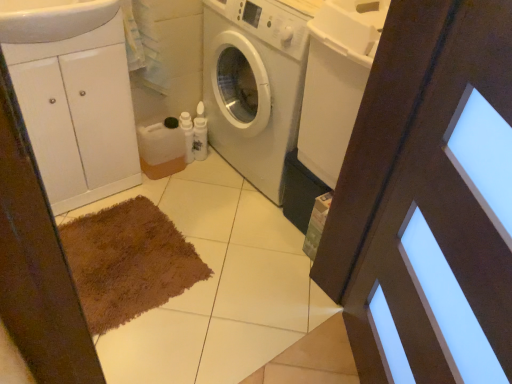
Question: Could you tell me if white glossy cabinet at left is facing white glossy sink at upper left?

Choices:
 (A) yes
 (B) no

Answer: (B)

Question: From the image's perspective, is white glossy cabinet at left beneath white glossy sink at upper left?

Choices:
 (A) no
 (B) yes

Answer: (B)

Question: Is white glossy cabinet at left bigger than white glossy sink at upper left?

Choices:
 (A) yes
 (B) no

Answer: (A)

Question: Is white glossy cabinet at left looking in the opposite direction of white glossy sink at upper left?

Choices:
 (A) yes
 (B) no

Answer: (B)

Question: Is white glossy cabinet at left behind white glossy sink at upper left?

Choices:
 (A) yes
 (B) no

Answer: (A)

Question: From a real-world perspective, is brown wooden screen door at center positioned above or below white glossy cabinet at left?

Choices:
 (A) below
 (B) above

Answer: (B)

Question: Looking at their shapes, would you say brown wooden screen door at center is wider or thinner than white glossy cabinet at left?

Choices:
 (A) wide
 (B) thin

Answer: (B)

Question: Is brown wooden screen door at center inside or outside of white glossy cabinet at left?

Choices:
 (A) outside
 (B) inside

Answer: (A)

Question: Does point (371, 276) appear closer or farther from the camera than point (61, 61)?

Choices:
 (A) closer
 (B) farther

Answer: (A)

Question: From a real-world perspective, is brown wooden screen door at center above or below white matte washing machine at center?

Choices:
 (A) below
 (B) above

Answer: (B)

Question: Is brown wooden screen door at center wider or thinner than white matte washing machine at center?

Choices:
 (A) thin
 (B) wide

Answer: (A)

Question: Considering the positions of brown wooden screen door at center and white matte washing machine at center in the image, is brown wooden screen door at center taller or shorter than white matte washing machine at center?

Choices:
 (A) tall
 (B) short

Answer: (A)

Question: Is brown wooden screen door at center inside or outside of white matte washing machine at center?

Choices:
 (A) inside
 (B) outside

Answer: (B)

Question: Is point (10, 3) closer or farther from the camera than point (285, 135)?

Choices:
 (A) closer
 (B) farther

Answer: (A)

Question: From the image's perspective, relative to white matte washing machine at center, is white glossy sink at upper left above or below?

Choices:
 (A) below
 (B) above

Answer: (B)